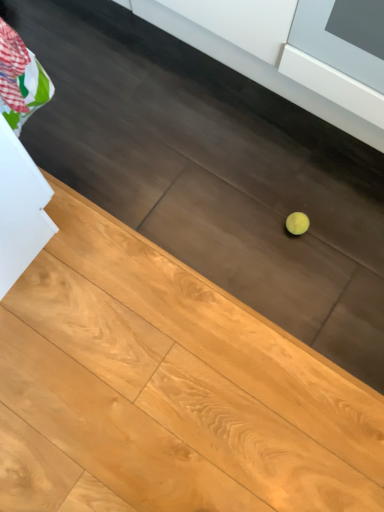
This screenshot has height=512, width=384. I want to click on vacant point above light wood plank at lower center (from a real-world perspective), so click(184, 259).